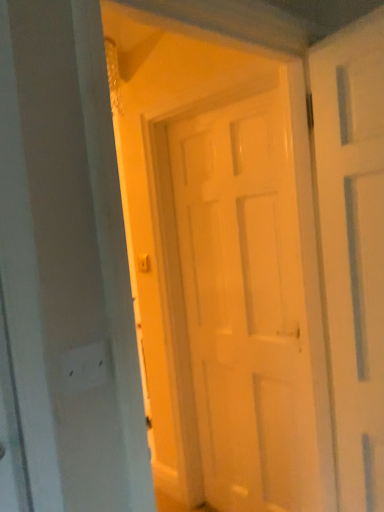
This screenshot has width=384, height=512. What do you see at coordinates (85, 367) in the screenshot?
I see `white matte electric outlet at lower left` at bounding box center [85, 367].

Where is `white matte electric outlet at lower left`? Image resolution: width=384 pixels, height=512 pixels. white matte electric outlet at lower left is located at coordinates (85, 367).

In order to face white matte door at center, should I rotate leftwards or rightwards?

Rotate right and turn 2.858 degrees.

Image resolution: width=384 pixels, height=512 pixels. Describe the element at coordinates (226, 274) in the screenshot. I see `white matte door at center` at that location.

Locate an element on the screen. white matte door at center is located at coordinates (226, 274).

The image size is (384, 512). What are the coordinates of `white matte electric outlet at lower left` in the screenshot? It's located at (85, 367).

Which object is positioned more to the left, white matte door at center or white matte electric outlet at lower left?

white matte electric outlet at lower left.

Considering the relative positions of white matte door at center and white matte electric outlet at lower left in the image provided, is white matte door at center in front of white matte electric outlet at lower left?

No, white matte door at center is behind white matte electric outlet at lower left.

Considering the points (312, 402) and (78, 357), which point is in front, point (312, 402) or point (78, 357)?

Positioned in front is point (78, 357).

From the image's perspective, is white matte door at center above or below white matte electric outlet at lower left?

white matte door at center is below white matte electric outlet at lower left.

From a real-world perspective, which object stands above the other?

From a 3D spatial view, white matte electric outlet at lower left is above.

Between white matte door at center and white matte electric outlet at lower left, which one has larger width?

white matte door at center.

Is white matte door at center taller than white matte electric outlet at lower left?

Correct, white matte door at center is much taller as white matte electric outlet at lower left.

Consider the image. Considering the sizes of white matte door at center and white matte electric outlet at lower left in the image, is white matte door at center bigger or smaller than white matte electric outlet at lower left?

In the image, white matte door at center appears to be larger than white matte electric outlet at lower left.

Would you say white matte electric outlet at lower left is part of white matte door at center's contents?

No, white matte electric outlet at lower left is not surrounded by white matte door at center.

Is white matte door at center beside white matte electric outlet at lower left?

No, white matte door at center is not touching white matte electric outlet at lower left.

Is white matte door at center oriented towards white matte electric outlet at lower left?

No, white matte door at center is not turned towards white matte electric outlet at lower left.

How different are the orientations of white matte door at center and white matte electric outlet at lower left in degrees?

The facing directions of white matte door at center and white matte electric outlet at lower left are 92.6 degrees apart.

Image resolution: width=384 pixels, height=512 pixels. In order to click on door on the right of the white matte electric outlet at lower left in this screenshot , I will do click(226, 274).

Which is more to the right, white matte electric outlet at lower left or white matte door at center?

Positioned to the right is white matte door at center.

Is white matte electric outlet at lower left in front of white matte door at center?

Yes, white matte electric outlet at lower left is closer to the camera.

Between point (106, 350) and point (316, 364), which one is positioned in front?

Positioned in front is point (106, 350).

From the image's perspective, is white matte electric outlet at lower left on white matte door at center?

Yes, from the image's perspective, white matte electric outlet at lower left is on top of white matte door at center.

From a real-world perspective, is white matte electric outlet at lower left on white matte door at center?

Indeed, from a real-world perspective, white matte electric outlet at lower left stands above white matte door at center.

Between white matte electric outlet at lower left and white matte door at center, which one has smaller width?

white matte electric outlet at lower left is thinner.

Considering the relative sizes of white matte electric outlet at lower left and white matte door at center in the image provided, is white matte electric outlet at lower left taller than white matte door at center?

No, white matte electric outlet at lower left is not taller than white matte door at center.

Does white matte electric outlet at lower left have a larger size compared to white matte door at center?

Incorrect, white matte electric outlet at lower left is not larger than white matte door at center.

Choose the correct answer: Is white matte electric outlet at lower left inside white matte door at center or outside it?

white matte electric outlet at lower left is spatially situated outside white matte door at center.

Is white matte electric outlet at lower left positioned far away from white matte door at center?

That's right, there is a large distance between white matte electric outlet at lower left and white matte door at center.

Is white matte electric outlet at lower left turned away from white matte door at center?

No, white matte electric outlet at lower left is not facing the opposite direction of white matte door at center.

Identify the location of door that is under the white matte electric outlet at lower left (from a real-world perspective). (226, 274).

Locate an element on the screen. electric outlet above the white matte door at center (from a real-world perspective) is located at coordinates (85, 367).

Find the location of `door behind the white matte electric outlet at lower left`. door behind the white matte electric outlet at lower left is located at coordinates (226, 274).